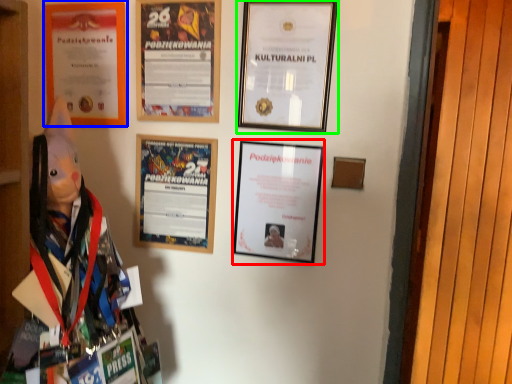
Question: Based on their relative distances, which object is nearer to picture frame (highlighted by a red box)? Choose from picture frame (highlighted by a blue box) and picture frame (highlighted by a green box).

Choices:
 (A) picture frame
 (B) picture frame

Answer: (B)